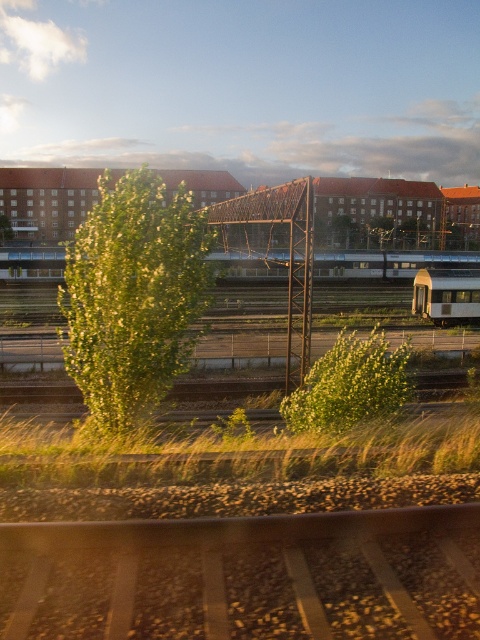
Is green leafy tree at center closer to the viewer compared to white glossy passenger train at center?

Yes, it is in front of white glossy passenger train at center.

Measure the distance between green leafy tree at center and white glossy passenger train at center.

green leafy tree at center and white glossy passenger train at center are 22.61 meters apart.

Identify the location of green leafy tree at center. (133, 296).

Identify the location of green leafy tree at center. (133, 296).

Looking at this image, does green leafy tree at center have a greater width compared to silver metallic train at center?

Incorrect, green leafy tree at center's width does not surpass silver metallic train at center's.

Who is positioned more to the left, green leafy tree at center or silver metallic train at center?

green leafy tree at center is more to the left.

Who is more forward, (180,339) or (242,273)?

Positioned in front is point (180,339).

I want to click on green leafy tree at center, so click(133, 296).

Which is below, brown gravel train track at bottom or green leafy tree at center?

Positioned lower is brown gravel train track at bottom.

Which is above, brown gravel train track at bottom or green leafy tree at center?

green leafy tree at center

Is point (466, 529) closer to camera compared to point (186, 195)?

That is True.

This screenshot has width=480, height=640. I want to click on brown gravel train track at bottom, so tap(245, 577).